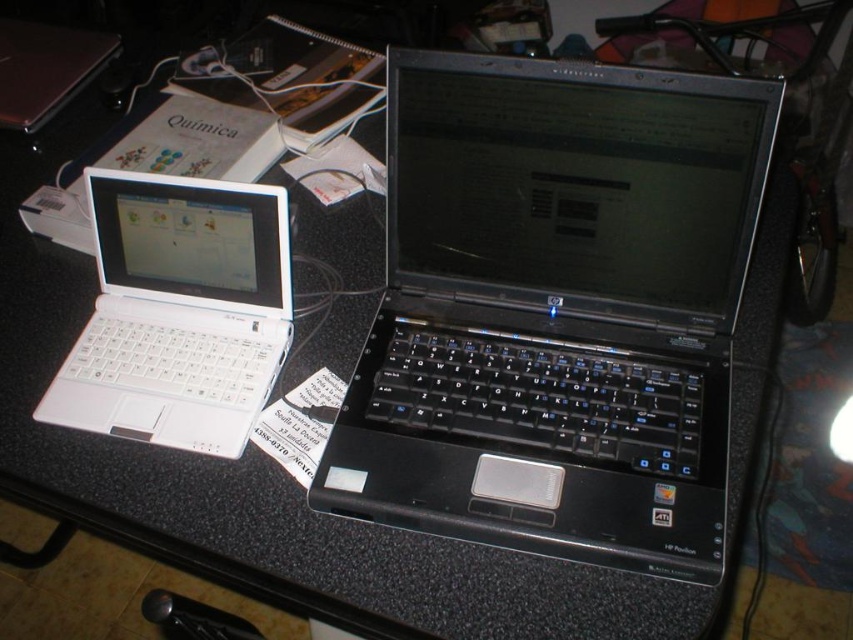
You are organizing your desk and need to place both the black plastic laptop at center and the white matte laptop at left into a storage box. The box can only fit one of the laptops. Based on their sizes, which one should you choose to fit into the box?

The white matte laptop at left is smaller than the black plastic laptop at center, so it would fit into the storage box.

You are organizing the desk and want to place a new item between the black plastic laptop at center and the white plastic laptop at left. Is there enough vertical space between them to fit a 3cm tall object?

The black plastic laptop at center is located below the white plastic laptop at left, so there is vertical space between them. Since the object is only 3cm tall, it should fit between them vertically.

You need to place a large textbook on the desk without covering either the black plastic laptop at center or the white plastic laptop at left. Given their sizes, which laptop should you avoid placing the textbook near to ensure enough space?

The black plastic laptop at center is larger than the white plastic laptop at left, so you should avoid placing the textbook near the black plastic laptop at center to ensure there is enough space for the textbook.